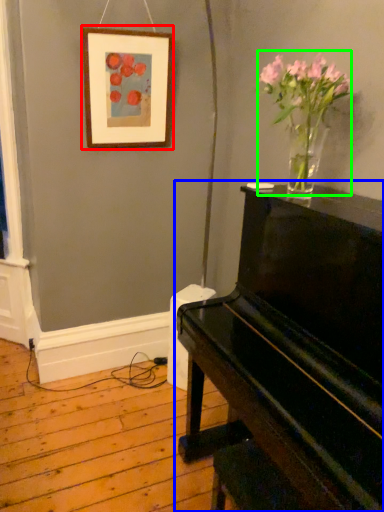
Question: Considering the real-world distances, which object is closest to picture frame (highlighted by a red box)? piano (highlighted by a blue box) or floral arrangement (highlighted by a green box).

Choices:
 (A) piano
 (B) floral arrangement

Answer: (B)